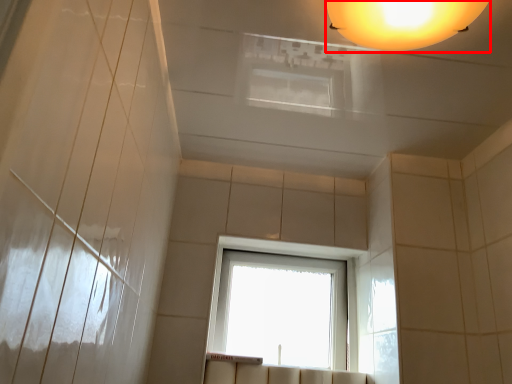
Question: From the image, what is the correct spatial relationship of lamp (annotated by the red box) in relation to window?

Choices:
 (A) left
 (B) right

Answer: (B)